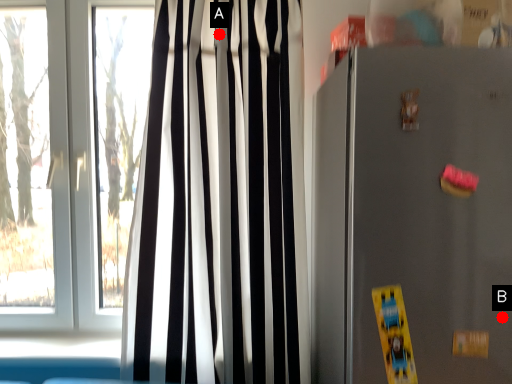
Question: Two points are circled on the image, labeled by A and B beside each circle. Which point is further to the camera?

Choices:
 (A) A is further
 (B) B is further

Answer: (A)